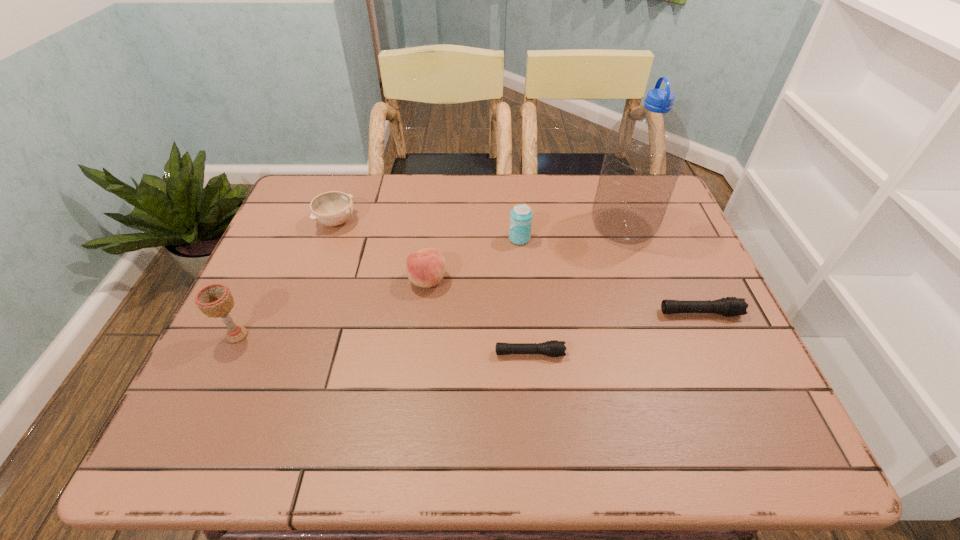
The image size is (960, 540). In the image, there is a desktop. Find the location of `vacant space at the far left corner`. vacant space at the far left corner is located at coordinates (305, 213).

In the image, there is a desktop. What are the coordinates of `free space at the near left corner` in the screenshot? It's located at (243, 404).

At what (x,y) coordinates should I click in order to perform the action: click on free space at the far right corner. Please return your answer as a coordinate pair (x, y). This screenshot has height=540, width=960. Looking at the image, I should click on (667, 212).

At what (x,y) coordinates should I click in order to perform the action: click on free spot between the beer can and the nearer flashlight. Please return your answer as a coordinate pair (x, y). The image size is (960, 540). Looking at the image, I should click on (524, 296).

Where is `free spot between the beer can and the sixth object from right to left`? The width and height of the screenshot is (960, 540). free spot between the beer can and the sixth object from right to left is located at coordinates (428, 230).

The image size is (960, 540). What are the coordinates of `free spot between the farther flashlight and the peach` in the screenshot? It's located at click(x=564, y=296).

The width and height of the screenshot is (960, 540). I want to click on free spot between the shortest object and the fourth nearest object, so click(x=478, y=317).

In order to click on free space between the beer can and the taller flashlight in this screenshot , I will do `click(610, 276)`.

The width and height of the screenshot is (960, 540). What are the coordinates of `vacant space in between the second shortest object and the nearer flashlight` in the screenshot? It's located at (614, 333).

At what (x,y) coordinates should I click in order to perform the action: click on free space between the second object from left to right and the nearer flashlight. Please return your answer as a coordinate pair (x, y). Image resolution: width=960 pixels, height=540 pixels. Looking at the image, I should click on click(433, 287).